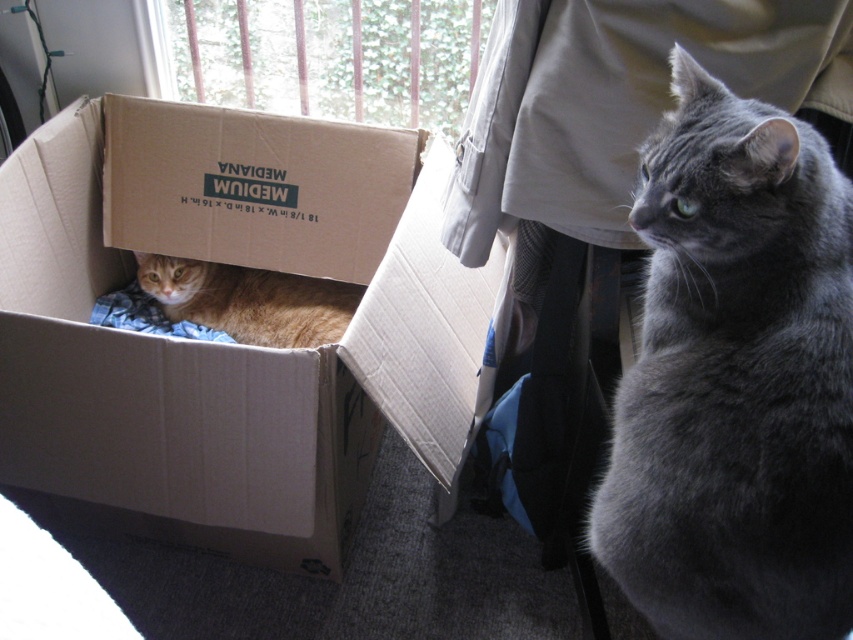
Question: Which of these objects is positioned farthest from the gray fluffy cat at center?

Choices:
 (A) orange tabby cat at left
 (B) cardboard box at left

Answer: (A)

Question: Which of these objects is positioned closest to the gray fluffy cat at center?

Choices:
 (A) orange tabby cat at left
 (B) cardboard box at left

Answer: (B)

Question: Can you confirm if cardboard box at left is positioned to the right of gray fluffy cat at center?

Choices:
 (A) no
 (B) yes

Answer: (A)

Question: Where is cardboard box at left located in relation to orange tabby cat at left in the image?

Choices:
 (A) below
 (B) above

Answer: (B)

Question: Which point appears closest to the camera in this image?

Choices:
 (A) (666, 608)
 (B) (106, 276)

Answer: (A)

Question: From the image, what is the correct spatial relationship of gray fluffy cat at center in relation to orange tabby cat at left?

Choices:
 (A) below
 (B) above

Answer: (A)